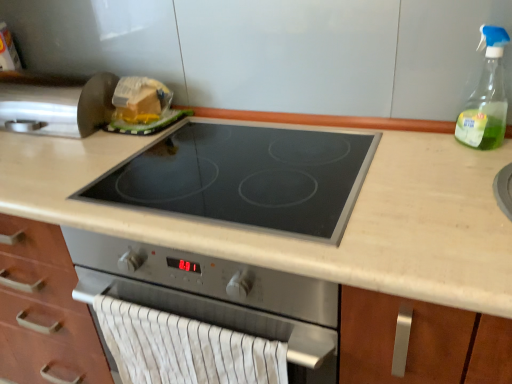
Find the location of a particular element. This screenshot has height=384, width=512. vacant area that is in front of metallic silver knife at upper left is located at coordinates (67, 166).